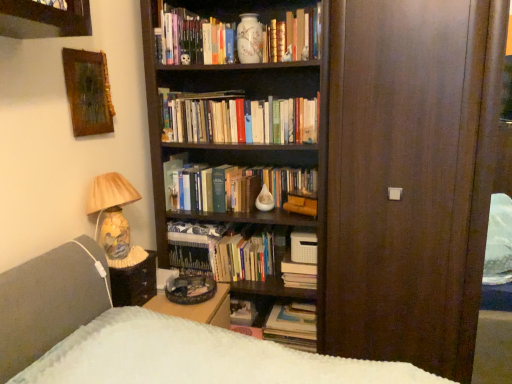
Question: Does matte ceramic vase at upper center, placed as the sixth book when sorted from bottom to top, come behind matte white vase at upper center, the 7th book from the bottom?

Choices:
 (A) no
 (B) yes

Answer: (A)

Question: Considering the relative positions of matte ceramic vase at upper center, placed as the sixth book when sorted from bottom to top, and matte white vase at upper center, the 7th book from the bottom, in the image provided, is matte ceramic vase at upper center, placed as the sixth book when sorted from bottom to top, to the left of matte white vase at upper center, the 7th book from the bottom, from the viewer's perspective?

Choices:
 (A) yes
 (B) no

Answer: (B)

Question: Is matte ceramic vase at upper center, placed as the sixth book when sorted from bottom to top, in front of matte white vase at upper center, the 7th book from the bottom?

Choices:
 (A) no
 (B) yes

Answer: (B)

Question: Can you confirm if matte ceramic vase at upper center, placed as the sixth book when sorted from bottom to top, is smaller than matte white vase at upper center, the 7th book from the bottom?

Choices:
 (A) no
 (B) yes

Answer: (B)

Question: Is matte ceramic vase at upper center, which is counted as the 2th book, starting from the top, positioned with its back to matte white vase at upper center, the 7th book from the bottom?

Choices:
 (A) yes
 (B) no

Answer: (B)

Question: Is matte white vase at upper center, the 1th book from the top, wider or thinner than brown wood door at center?

Choices:
 (A) thin
 (B) wide

Answer: (B)

Question: In terms of size, does matte white vase at upper center, the 7th book from the bottom, appear bigger or smaller than brown wood door at center?

Choices:
 (A) big
 (B) small

Answer: (B)

Question: Considering the positions of point (211, 52) and point (421, 71), is point (211, 52) closer or farther from the camera than point (421, 71)?

Choices:
 (A) closer
 (B) farther

Answer: (B)

Question: Is matte white vase at upper center, the 1th book from the top, situated inside brown wood door at center or outside?

Choices:
 (A) inside
 (B) outside

Answer: (B)

Question: Does point (94, 105) appear closer or farther from the camera than point (296, 100)?

Choices:
 (A) farther
 (B) closer

Answer: (B)

Question: From the image's perspective, is wooden-framed painting at upper left positioned above or below hardcover books at center, which ranks as the 5th book in bottom-to-top order?

Choices:
 (A) above
 (B) below

Answer: (A)

Question: Is wooden-framed painting at upper left taller or shorter than hardcover books at center, which ranks as the 5th book in bottom-to-top order?

Choices:
 (A) tall
 (B) short

Answer: (A)

Question: Is wooden-framed painting at upper left inside the boundaries of hardcover books at center, acting as the 3th book starting from the top, or outside?

Choices:
 (A) outside
 (B) inside

Answer: (A)

Question: Is hardcover book at lower center, which ranks as the 1th book in bottom-to-top order, taller or shorter than matte ceramic lamp at left?

Choices:
 (A) short
 (B) tall

Answer: (A)

Question: Visually, is hardcover book at lower center, the seventh book positioned from the top, positioned to the left or to the right of matte ceramic lamp at left?

Choices:
 (A) left
 (B) right

Answer: (B)